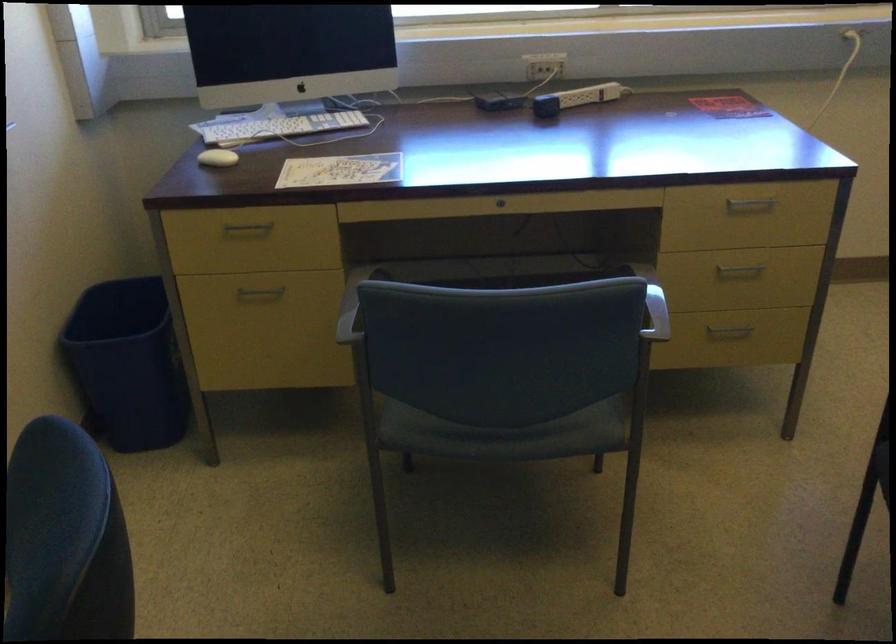
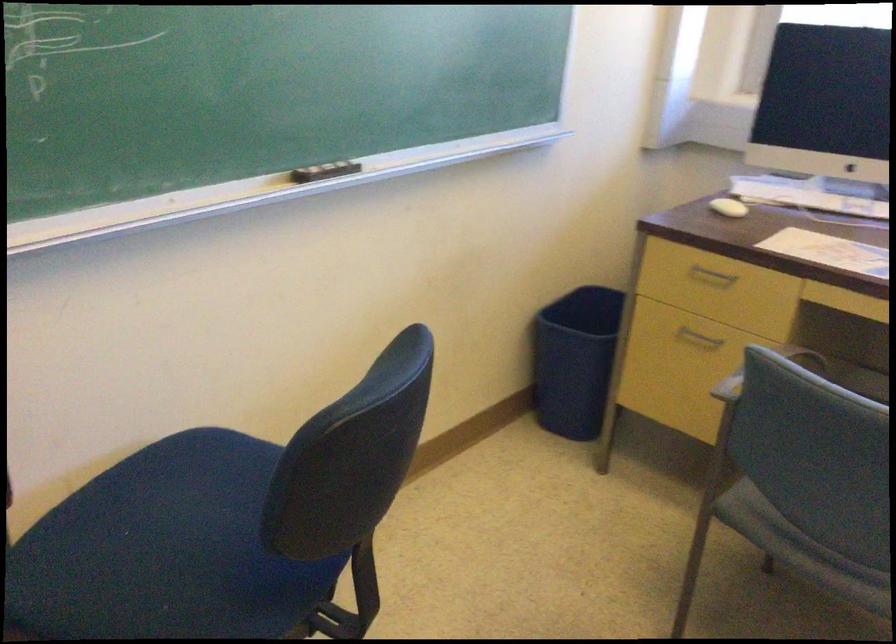
In the second image, find the point that corresponds to [128,375] in the first image.

(574, 360)